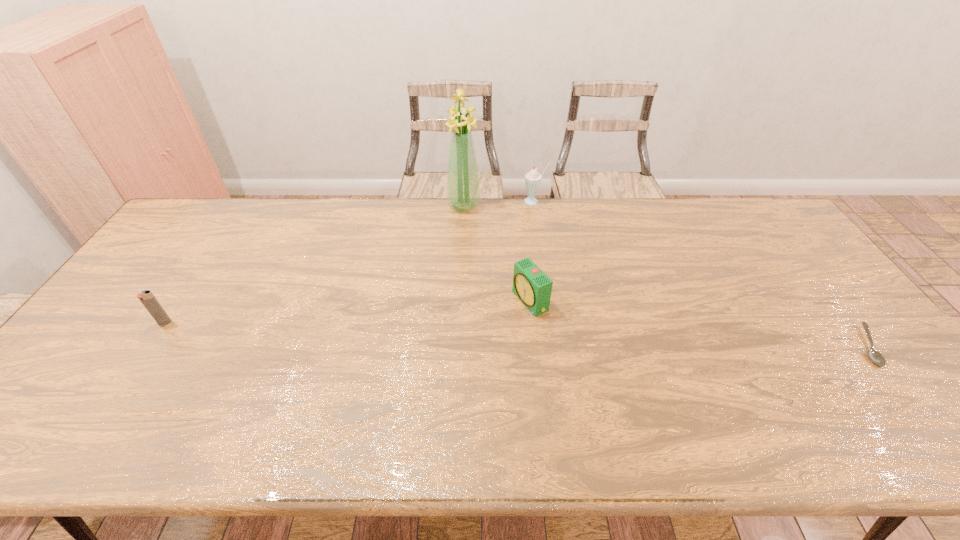
Find the location of a particular element. vacant space that satisfies the following two spatial constraints: 1. on the back side of the tallest object; 2. on the right side of the fourth shortest object is located at coordinates (464, 201).

At what (x,y) coordinates should I click in order to perform the action: click on vacant space that satisfies the following two spatial constraints: 1. on the back side of the fourth shortest object; 2. on the right side of the fourth object from right to left. Please return your answer as a coordinate pair (x, y). This screenshot has width=960, height=540. Looking at the image, I should click on (464, 201).